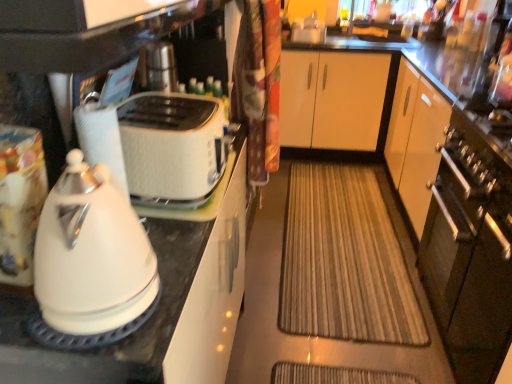
Find the location of a particular element. free location to the right of white glossy paper towel at left is located at coordinates (163, 220).